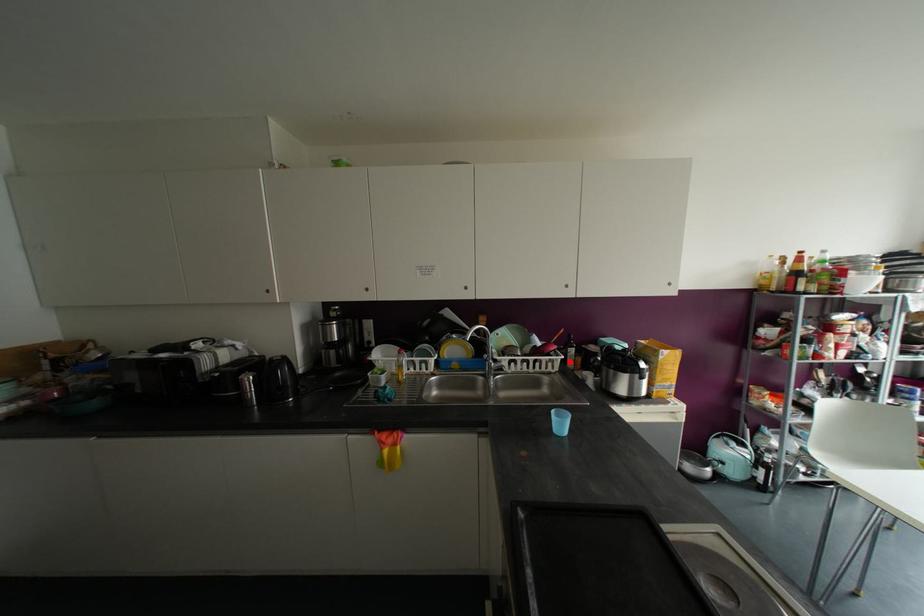
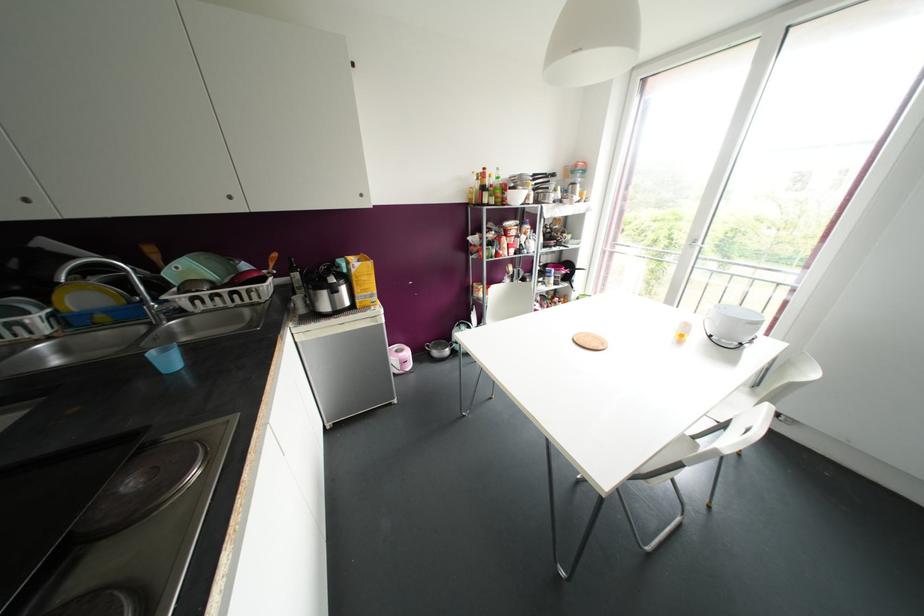
Question: I am providing you with two images of the same scene from different viewpoints. A red point is marked on the first image. At the location where the point appears in image 1, is it still visible in image 2?

Choices:
 (A) Yes
 (B) No

Answer: (A)